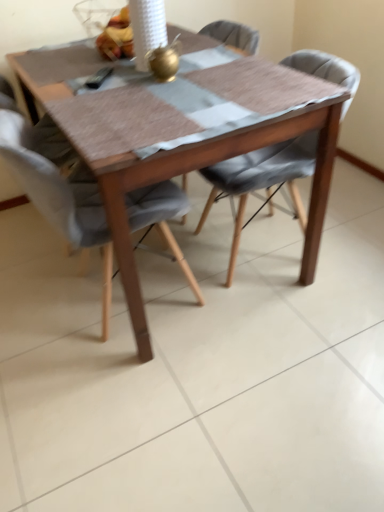
You are a GUI agent. You are given a task and a screenshot of the screen. Output one action in this format:
    pyautogui.click(x=<x>, y=<y>)
    Task: Click on the free space above wooden table at center (from a real-world perspective)
    
    Given the screenshot: What is the action you would take?
    pyautogui.click(x=153, y=83)